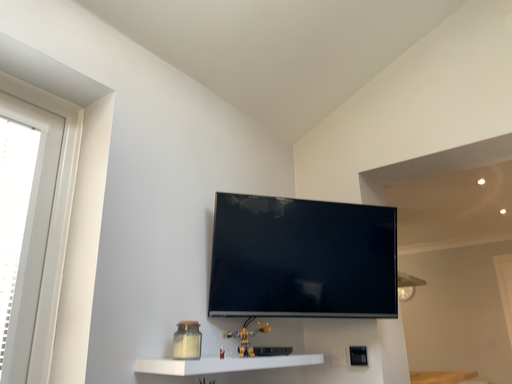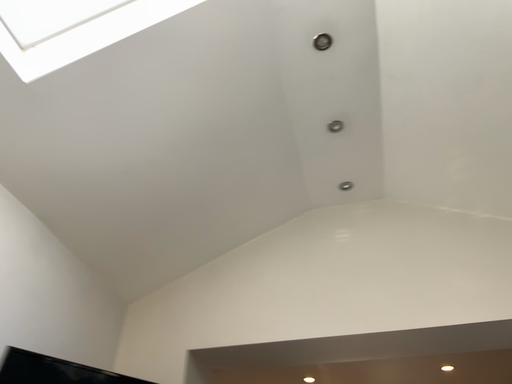
Question: Which way did the camera rotate in the video?

Choices:
 (A) rotated downward
 (B) rotated upward

Answer: (B)